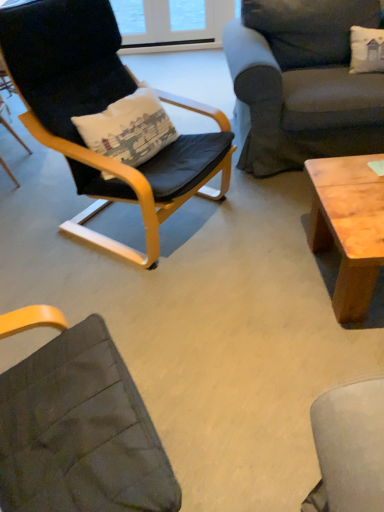
This screenshot has width=384, height=512. I want to click on vacant space situated on the left part of natural wood coffee table at right, so click(250, 284).